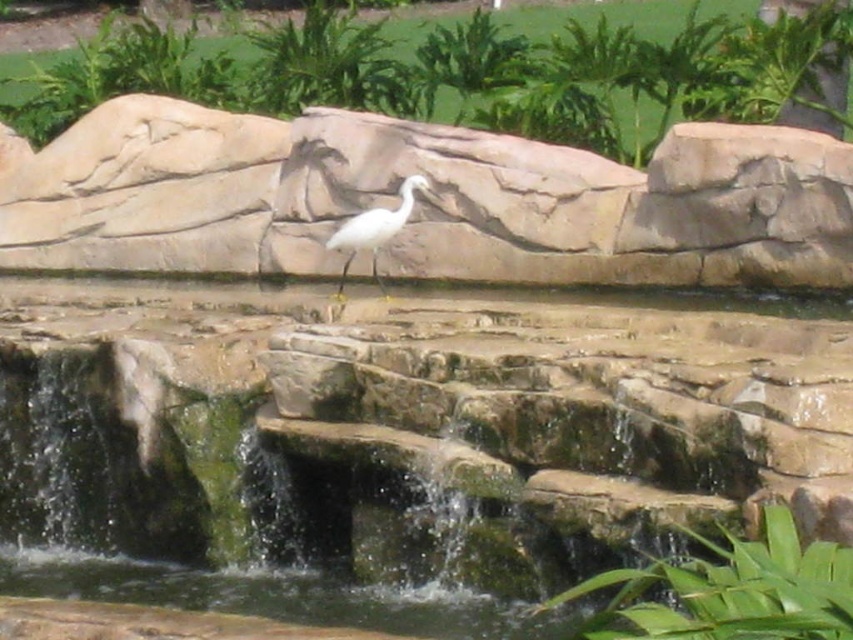
You are a photographer trying to capture the white smooth bird at center without the smooth stone wall at center blocking the view. From your current position, can you adjust your angle to frame the bird without the wall obstructing it?

The smooth stone wall at center is in front of the white smooth bird at center, so you cannot adjust your angle to frame the bird without the wall obstructing it.

You are a photographer trying to capture the white smooth bird at center and the smooth stone wall at center in the same frame. Based on their sizes, do you think both can fit comfortably in your camera viewfinder?

The smooth stone wall at center might be wider than white smooth bird at center, so there is a possibility that both can fit comfortably in the camera viewfinder depending on the distance and angle.